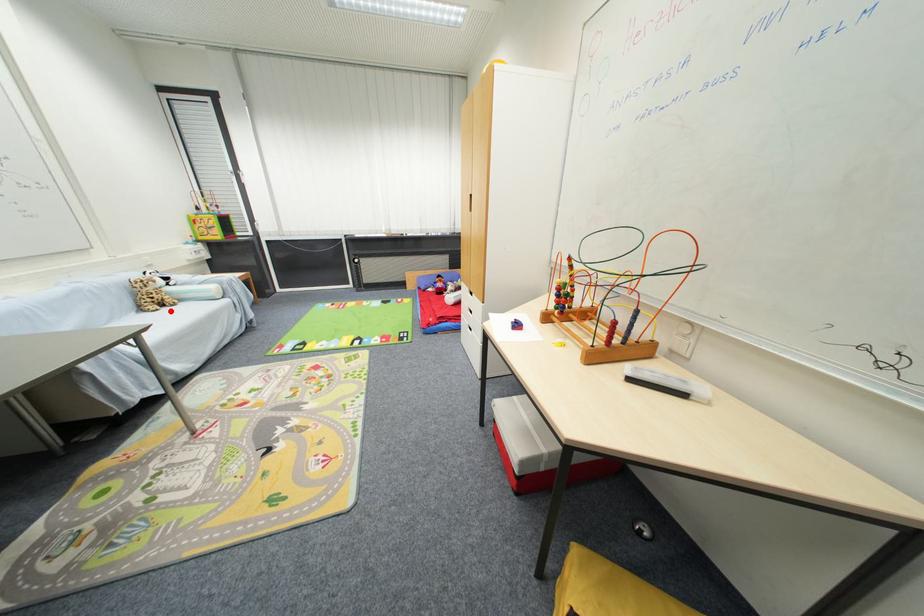
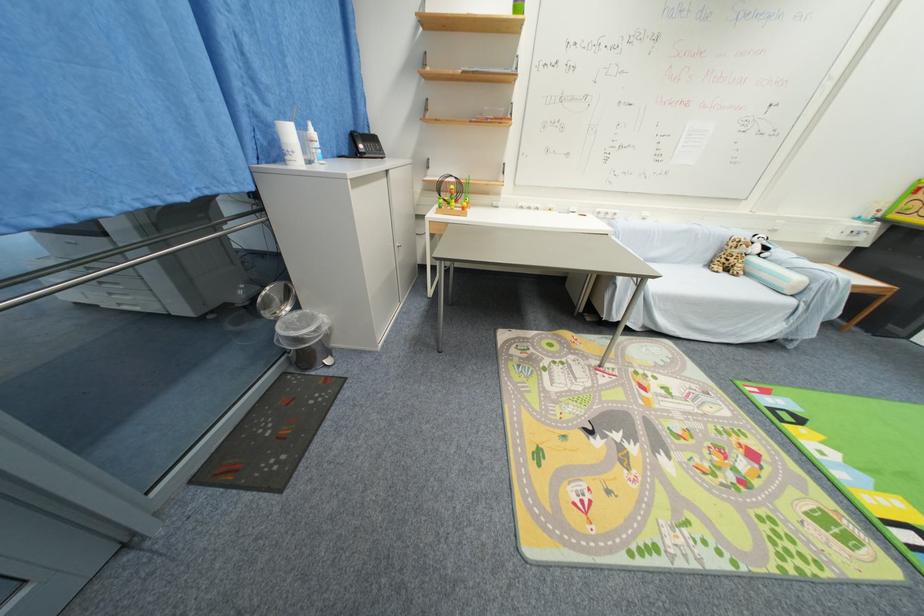
Where in the second image is the point corresponding to the highlighted location from the first image?

(730, 276)